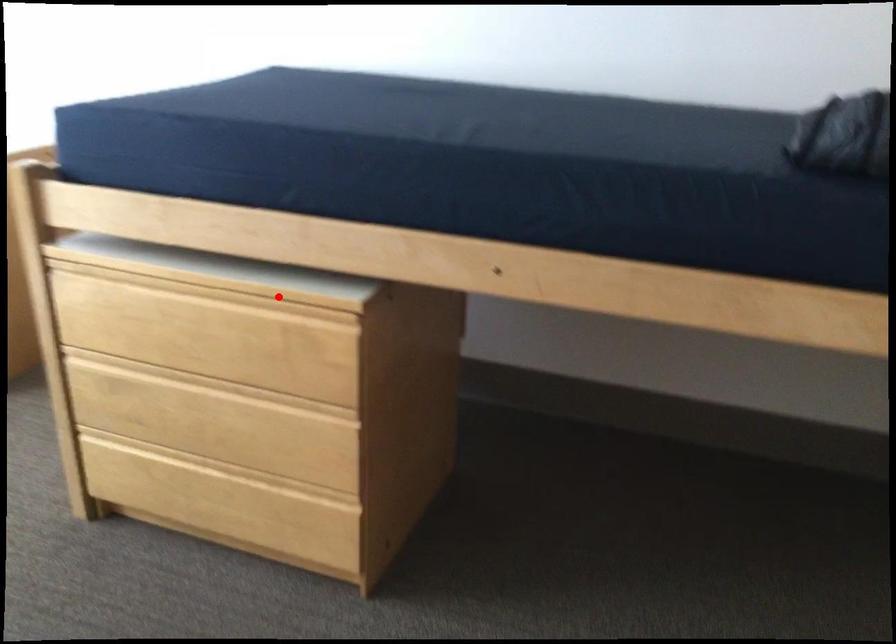
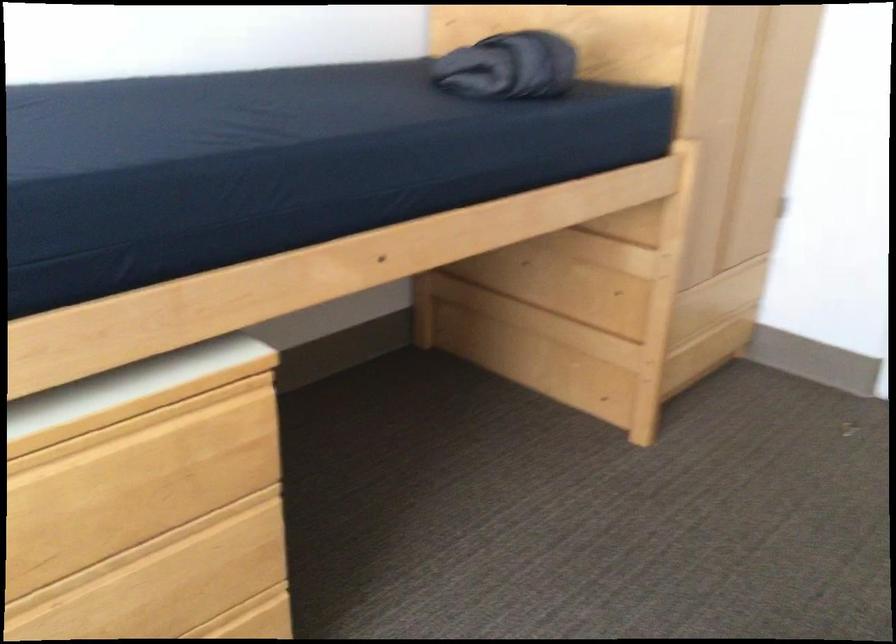
In the second image, find the point that corresponds to the highlighted location in the first image.

(133, 413)